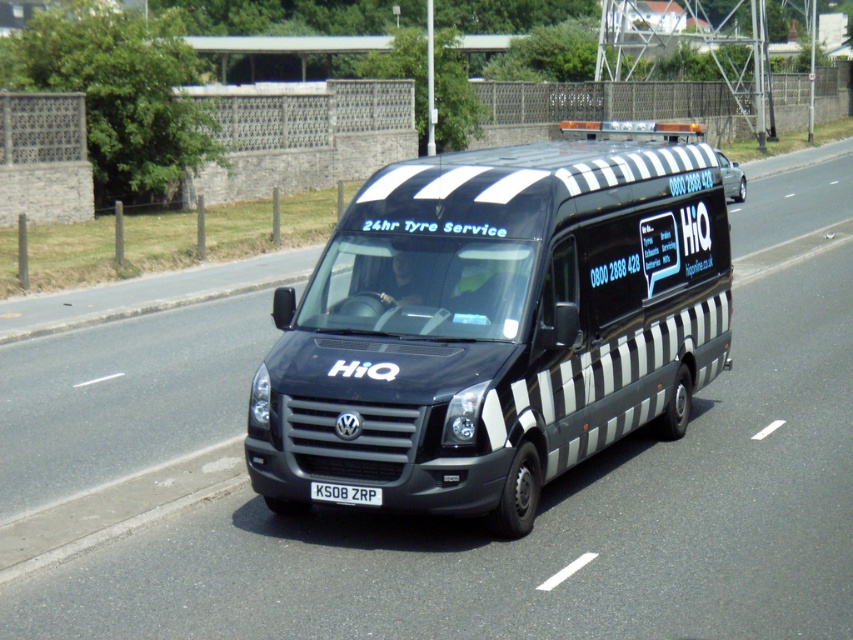
Does matte black van at center have a greater height compared to black metallic license plate at center?

Yes.

Is point (585, 305) less distant than point (335, 483)?

No, (585, 305) is further to viewer.

Which is behind, point (656, 244) or point (318, 493)?

The point (656, 244) is behind.

Find the location of `matte black van at center`. matte black van at center is located at coordinates (497, 324).